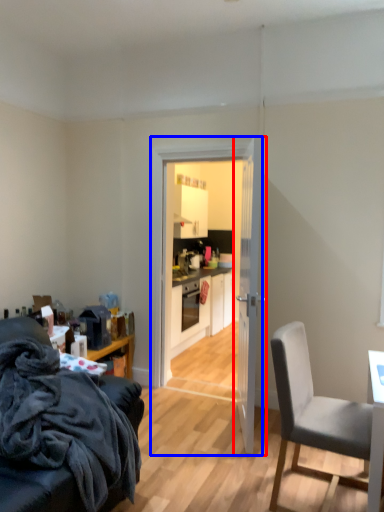
Question: Which object appears farthest to the camera in this image, door (highlighted by a red box) or glass door (highlighted by a blue box)?

Choices:
 (A) door
 (B) glass door

Answer: (B)